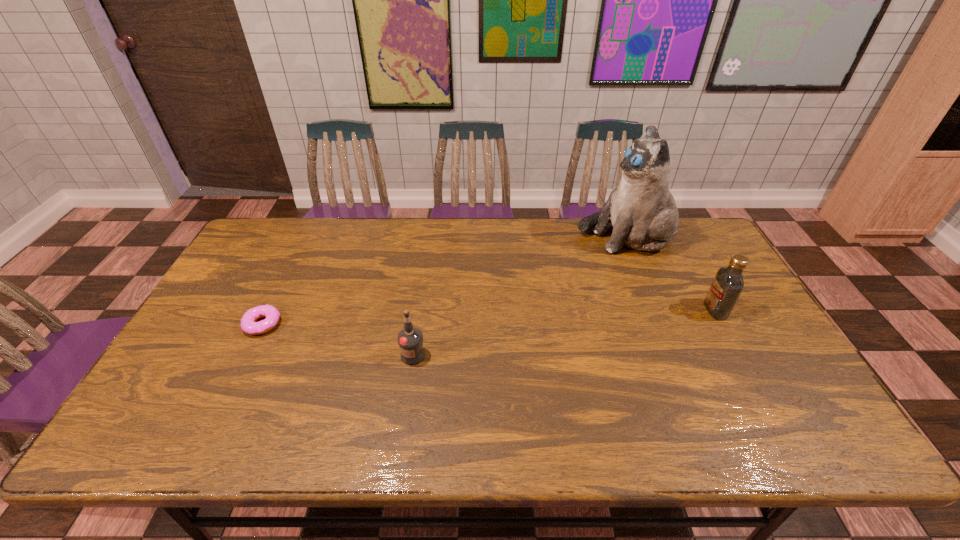
This screenshot has width=960, height=540. I want to click on vacant area situated at the face of the cat, so click(548, 237).

Where is `free spot located 0.310m on the front-facing side of the taller vodka`? free spot located 0.310m on the front-facing side of the taller vodka is located at coordinates (598, 310).

This screenshot has height=540, width=960. Find the location of `free space located on the front-facing side of the taller vodka`. free space located on the front-facing side of the taller vodka is located at coordinates (609, 310).

I want to click on vacant region located 0.110m on the front-facing side of the taller vodka, so click(667, 310).

You are a GUI agent. You are given a task and a screenshot of the screen. Output one action in this format:
    pyautogui.click(x=<x>, y=<y>)
    Task: Click on the free space located 0.170m on the front label of the second object from left to right
    Image resolution: width=960 pixels, height=540 pixels.
    Given the screenshot: What is the action you would take?
    pyautogui.click(x=403, y=427)

Identify the location of blank space located on the right of the shortest object. (392, 324).

Image resolution: width=960 pixels, height=540 pixels. What are the coordinates of `object that is at the far edge` in the screenshot? It's located at (641, 208).

You are a GUI agent. You are given a task and a screenshot of the screen. Output one action in this format:
    pyautogui.click(x=<x>, y=<y>)
    Task: Click on the object present at the left edge
    This screenshot has width=960, height=540.
    Given the screenshot: What is the action you would take?
    pyautogui.click(x=248, y=324)

Image resolution: width=960 pixels, height=540 pixels. Find the location of `cat that is at the right edge`. cat that is at the right edge is located at coordinates (641, 208).

The width and height of the screenshot is (960, 540). In order to click on vodka located at the right edge in this screenshot , I will do `click(728, 283)`.